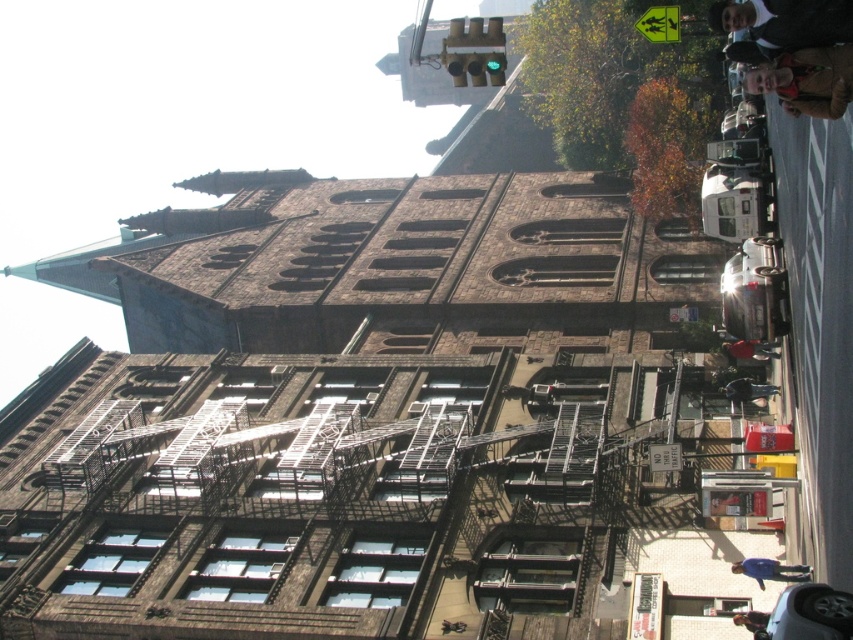
Question: Which point is closer to the camera?

Choices:
 (A) red fabric jacket at lower right
 (B) dark brown leather jacket at upper right

Answer: (B)

Question: Which object is the closest to the dark brown leather jacket at lower right?

Choices:
 (A) light brown leather jacket at upper right
 (B) brown leather jacket at lower right
 (C) blue fabric at lower right
 (D) dark brown leather jacket at upper right

Answer: (C)

Question: Observing the image, what is the correct spatial positioning of dark brown leather jacket at upper right in reference to blue fabric at lower right?

Choices:
 (A) right
 (B) left

Answer: (A)

Question: Which object appears farthest from the camera in this image?

Choices:
 (A) blue fabric at lower right
 (B) dark brown leather jacket at upper right
 (C) light brown leather jacket at upper right

Answer: (A)

Question: Is dark brown leather jacket at upper right below dark brown leather jacket at lower right?

Choices:
 (A) yes
 (B) no

Answer: (B)

Question: Observing the image, what is the correct spatial positioning of blue fabric at lower right in reference to dark brown leather jacket at lower right?

Choices:
 (A) right
 (B) left

Answer: (B)